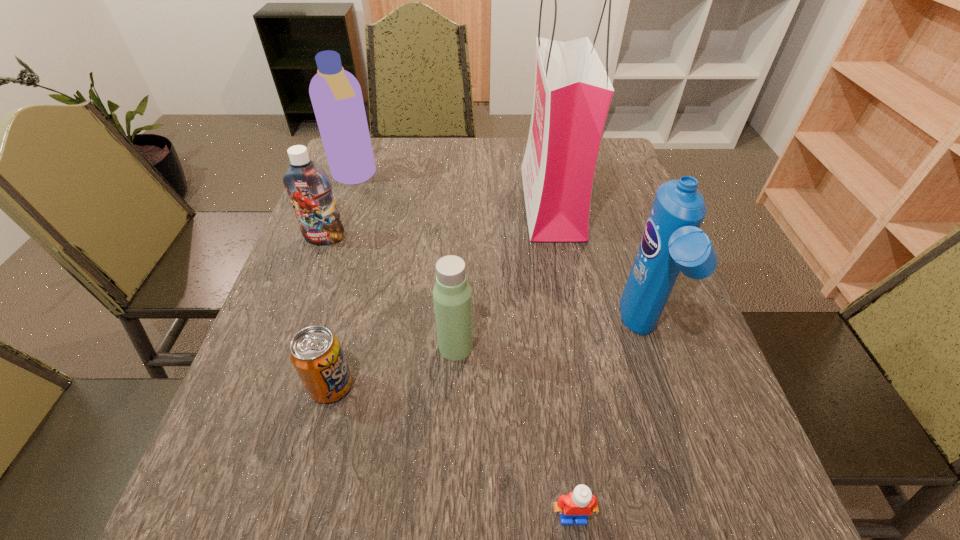
Identify the location of free spot between the thermos bottle and the soda can. (394, 366).

Locate an element on the screen. Image resolution: width=960 pixels, height=540 pixels. vacant area that lies between the tallest object and the shortest object is located at coordinates (562, 359).

Image resolution: width=960 pixels, height=540 pixels. What are the coordinates of `vacant space that's between the second shortest object and the shortest shampoo` in the screenshot? It's located at (328, 312).

The height and width of the screenshot is (540, 960). I want to click on empty location between the shortest shampoo and the rightmost object, so click(483, 285).

Locate an element on the screen. The image size is (960, 540). vacant area that lies between the farthest shampoo and the soda can is located at coordinates (343, 281).

I want to click on vacant region between the soda can and the farthest shampoo, so click(343, 281).

This screenshot has width=960, height=540. I want to click on unoccupied area between the rightmost object and the thermos bottle, so click(x=549, y=339).

The width and height of the screenshot is (960, 540). I want to click on the fifth closest object to the soda can, so click(x=672, y=241).

Locate which object is the closest to the fourth object from left to right. Please provide its 2D coordinates. Your answer should be formatted as a tuple, i.e. [(x, y)], where the tuple contains the x and y coordinates of a point satisfying the conditions above.

[(315, 352)]

Where is `shampoo identified as the closest to the shortest object`? Image resolution: width=960 pixels, height=540 pixels. shampoo identified as the closest to the shortest object is located at coordinates (672, 241).